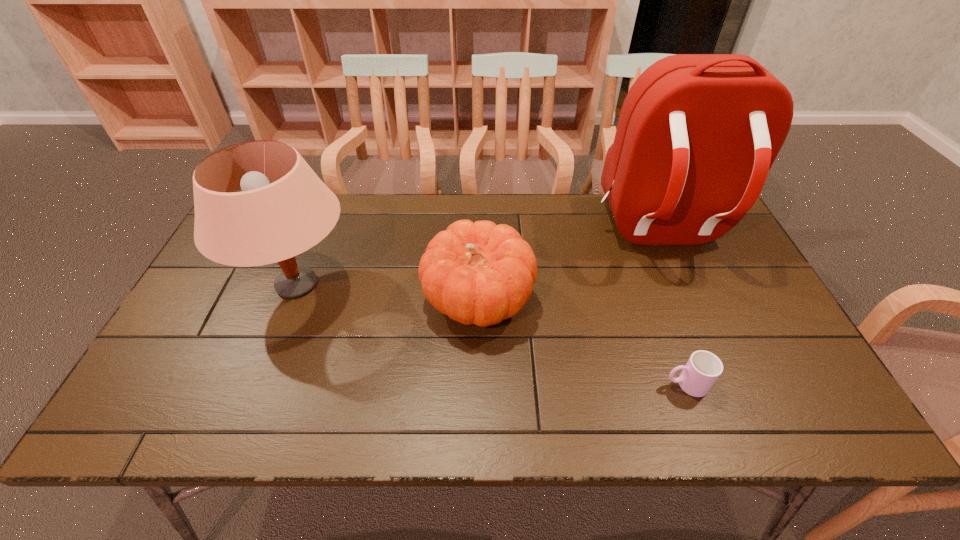
I want to click on vacant space that is in between the third tallest object and the cup, so click(x=582, y=342).

In order to click on vacant space in between the pumpkin and the nearest object in this screenshot , I will do `click(582, 342)`.

Find the location of a particular element. The image size is (960, 540). the closest object to the shortest object is located at coordinates (480, 273).

Choose which object is the third nearest neighbor to the pumpkin. Please provide its 2D coordinates. Your answer should be formatted as a tuple, i.e. [(x, y)], where the tuple contains the x and y coordinates of a point satisfying the conditions above.

[(703, 368)]

This screenshot has height=540, width=960. I want to click on blank area in the image that satisfies the following two spatial constraints: 1. on the strap side of the tallest object; 2. on the front-facing side of the second tallest object, so click(x=682, y=285).

Locate an element on the screen. free space in the image that satisfies the following two spatial constraints: 1. with the handle on the side of the shortest object; 2. on the front side of the third object from right to left is located at coordinates (656, 300).

Identify the location of blank area in the image that satisfies the following two spatial constraints: 1. on the front-facing side of the third shortest object; 2. with the handle on the side of the cup. This screenshot has width=960, height=540. (258, 384).

Locate an element on the screen. free space that satisfies the following two spatial constraints: 1. on the front-facing side of the second shortest object; 2. on the left side of the third shortest object is located at coordinates (291, 300).

This screenshot has height=540, width=960. I want to click on free region that satisfies the following two spatial constraints: 1. with the handle on the side of the nearest object; 2. on the front-facing side of the leftmost object, so click(650, 285).

This screenshot has height=540, width=960. Identify the location of vacant space that satisfies the following two spatial constraints: 1. with the handle on the side of the nearest object; 2. on the front-facing side of the leftmost object. [650, 285].